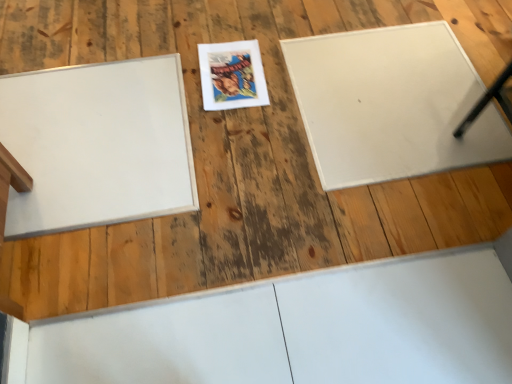
Identify the location of vacant space to the left of white matte board at upper right, which is the 2th bulletin board in left-to-right order. (217, 130).